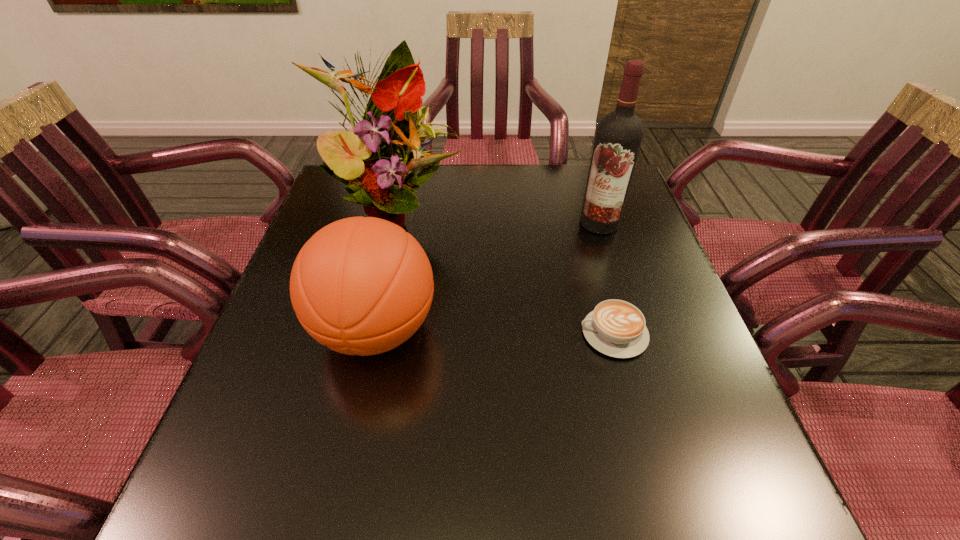
Identify the location of free spot between the wine bottle and the cappuccino. (607, 278).

Identify the location of object that is the second closest to the cappuccino. This screenshot has height=540, width=960. (362, 286).

Identify which object is located as the nearest to the second shortest object. Please provide its 2D coordinates. Your answer should be formatted as a tuple, i.e. [(x, y)], where the tuple contains the x and y coordinates of a point satisfying the conditions above.

[(379, 170)]

Identify the location of vacant space that satisfies the following two spatial constraints: 1. on the front side of the third tallest object; 2. on the right side of the bouquet. The height and width of the screenshot is (540, 960). (368, 330).

The height and width of the screenshot is (540, 960). Find the location of `blank area in the image that satisfies the following two spatial constraints: 1. on the front side of the wine bottle; 2. on the right side of the bouquet`. blank area in the image that satisfies the following two spatial constraints: 1. on the front side of the wine bottle; 2. on the right side of the bouquet is located at coordinates (393, 223).

At what (x,y) coordinates should I click in order to perform the action: click on blank area in the image that satisfies the following two spatial constraints: 1. on the front side of the bouquet; 2. on the side of the shortest object with the handle. Please return your answer as a coordinate pair (x, y). The width and height of the screenshot is (960, 540). Looking at the image, I should click on (367, 334).

Where is `vacant area that satisfies the following two spatial constraints: 1. on the front side of the cappuccino; 2. on the side of the bouquet with the handle`? The width and height of the screenshot is (960, 540). vacant area that satisfies the following two spatial constraints: 1. on the front side of the cappuccino; 2. on the side of the bouquet with the handle is located at coordinates (367, 334).